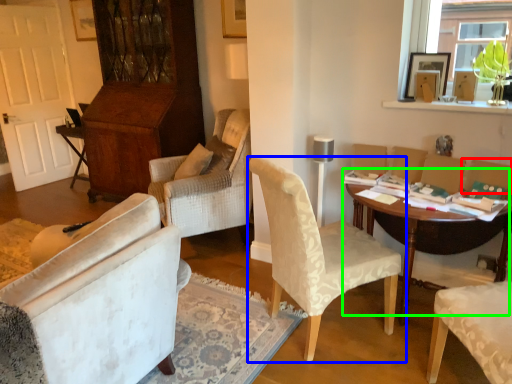
Question: Estimate the real-world distances between objects in this image. Which object is farther from armchair (highlighted by a red box), chair (highlighted by a blue box) or table (highlighted by a green box)?

Choices:
 (A) chair
 (B) table

Answer: (A)